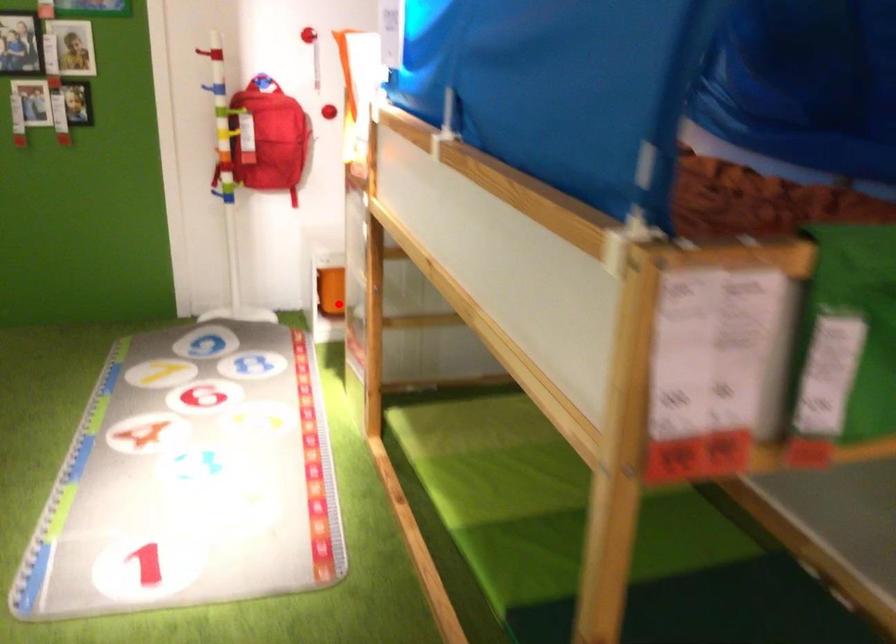
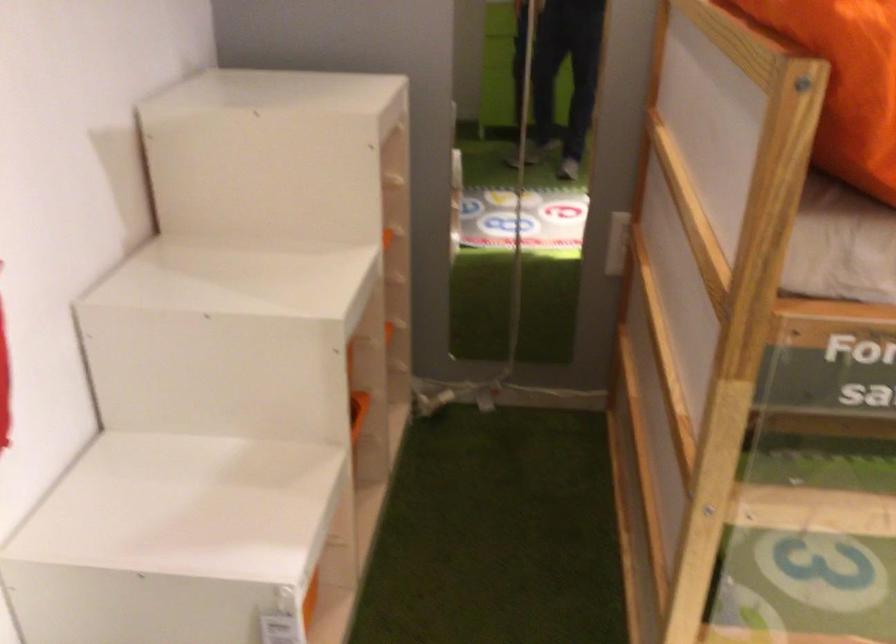
Question: I am providing you with two images of the same scene from different viewpoints. Image1 has a red point marked. In image2, the corresponding 3D location appears at what relative position? Reply with the corresponding letter.

Choices:
 (A) Closer
 (B) Farther

Answer: (A)